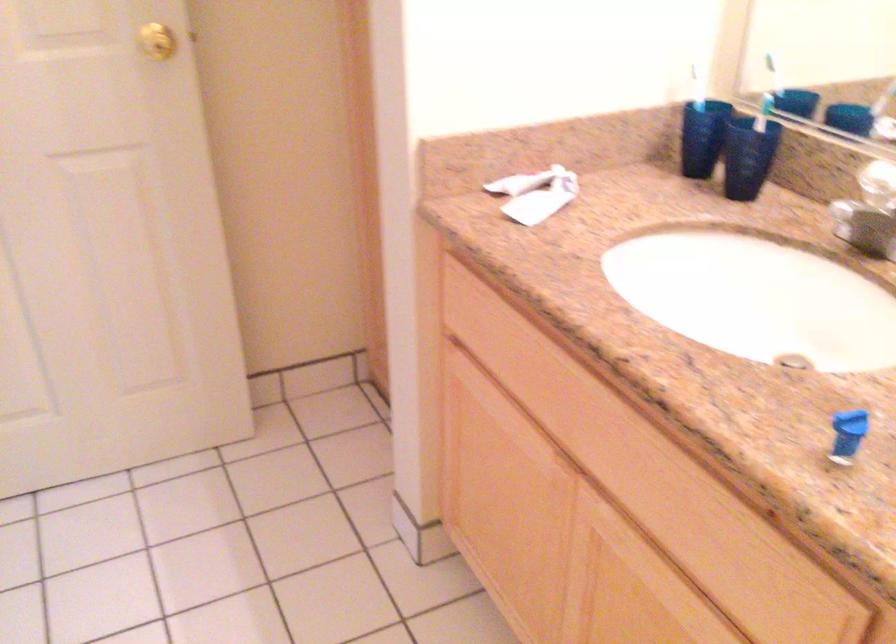
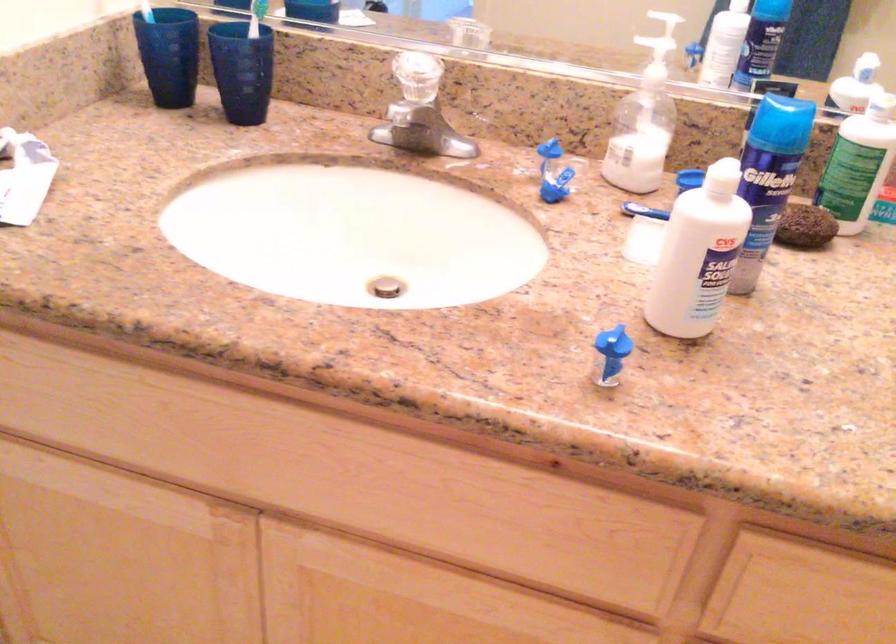
Where in the second image is the point corresponding to (693,134) from the first image?

(168, 55)